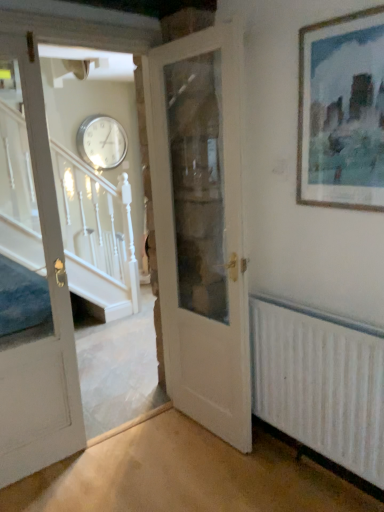
This screenshot has width=384, height=512. In order to click on vacant space underneath white textured radiator at lower right (from a real-world perspective) in this screenshot , I will do `click(323, 479)`.